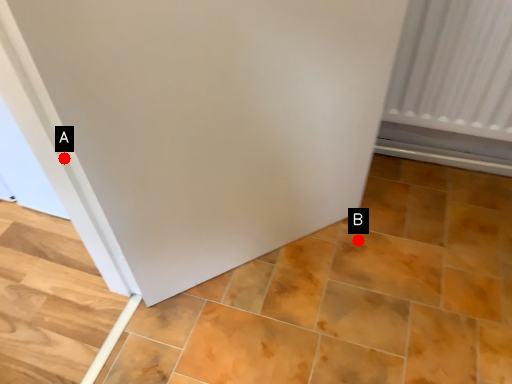
Question: Two points are circled on the image, labeled by A and B beside each circle. Which of the following is the farthest from the observer?

Choices:
 (A) A is further
 (B) B is further

Answer: (B)